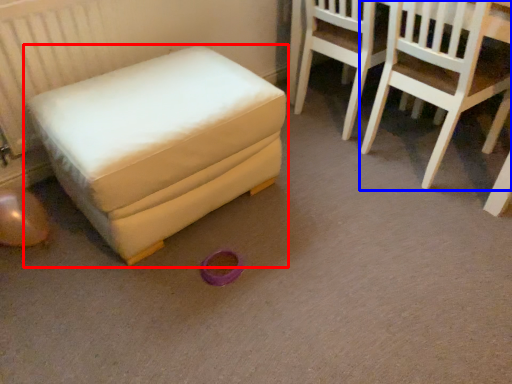
Question: Which of the following is the farthest to the observer, furniture (highlighted by a red box) or chair (highlighted by a blue box)?

Choices:
 (A) furniture
 (B) chair

Answer: (B)